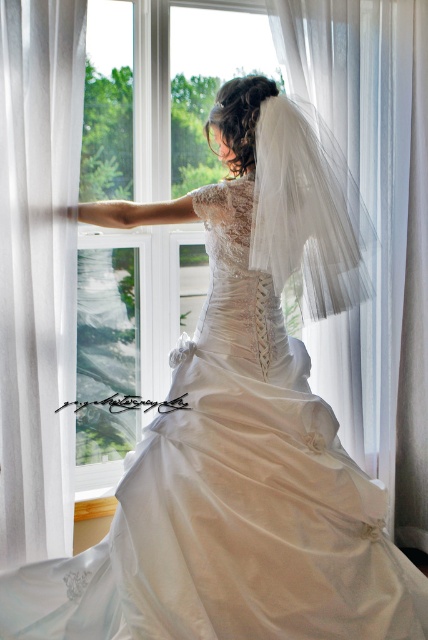
Between white sheer curtain at left and white tulle veil at center, which one is positioned lower?

white sheer curtain at left is below.

Which is above, white sheer curtain at left or white tulle veil at center?

Positioned higher is white tulle veil at center.

Who is more forward, (20, 179) or (258, 186)?

Point (258, 186) is in front.

What are the coordinates of `white sheer curtain at left` in the screenshot? It's located at (38, 269).